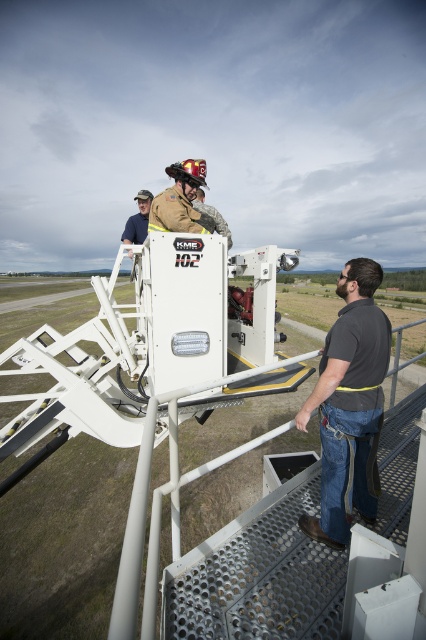
The height and width of the screenshot is (640, 426). What do you see at coordinates (348, 401) in the screenshot? I see `dark gray shirt at center` at bounding box center [348, 401].

Measure the distance between dark gray shirt at center and camera.

The distance of dark gray shirt at center from camera is 7.57 feet.

Who is more forward, (360, 300) or (186, 216)?

Point (360, 300)

Image resolution: width=426 pixels, height=640 pixels. Identify the location of dark gray shirt at center. (348, 401).